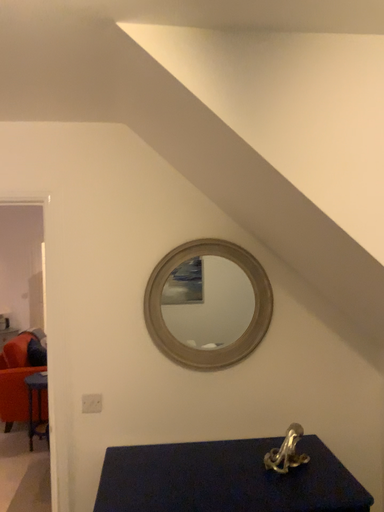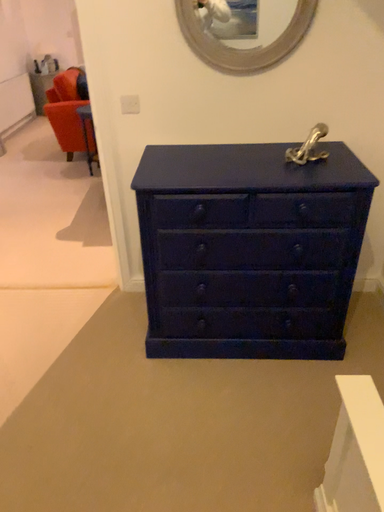
Question: How did the camera likely rotate when shooting the video?

Choices:
 (A) rotated left
 (B) rotated right

Answer: (A)